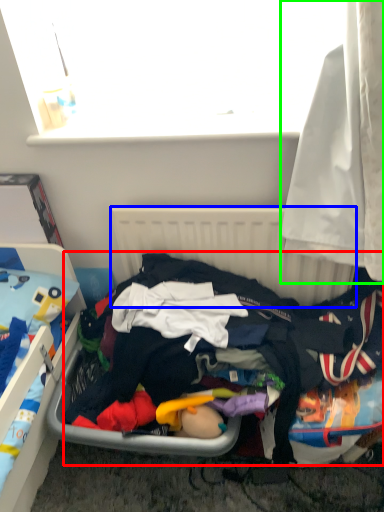
Question: Estimate the real-world distances between objects in this image. Which object is closer to clothing (highlighted by a red box), radiator (highlighted by a blue box) or curtain (highlighted by a green box)?

Choices:
 (A) radiator
 (B) curtain

Answer: (A)